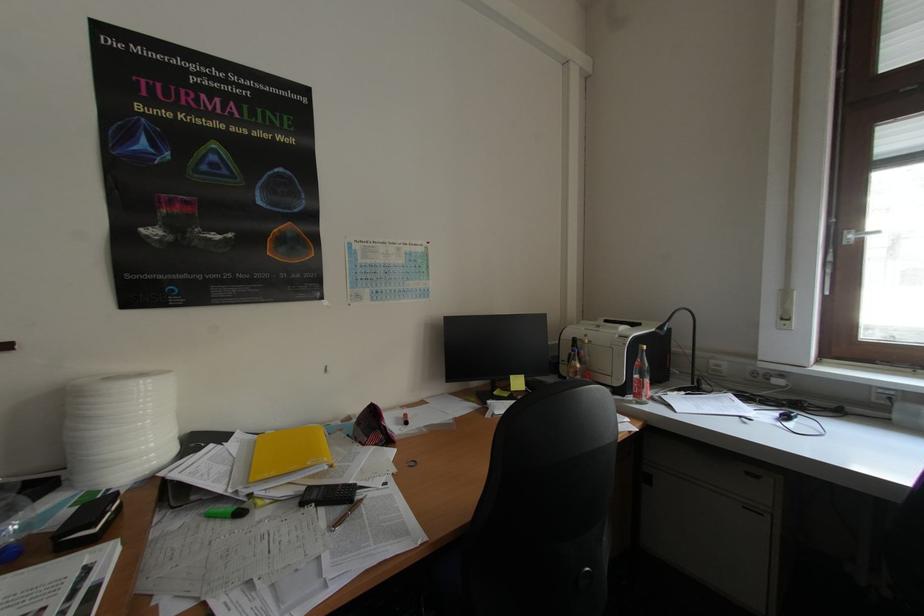
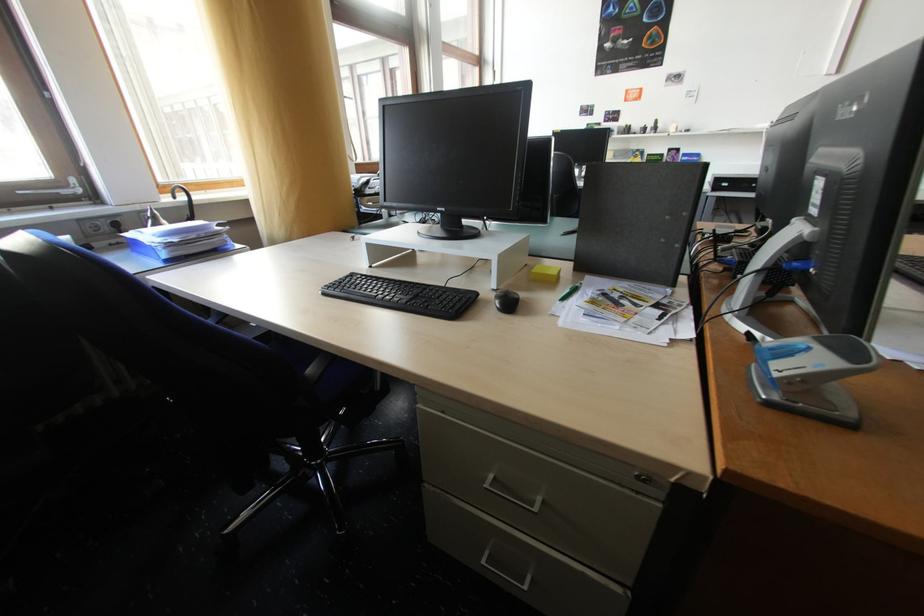
The first image is from the beginning of the video and the second image is from the end. How did the camera likely rotate when shooting the video?

The rotation direction of the camera is right-down.